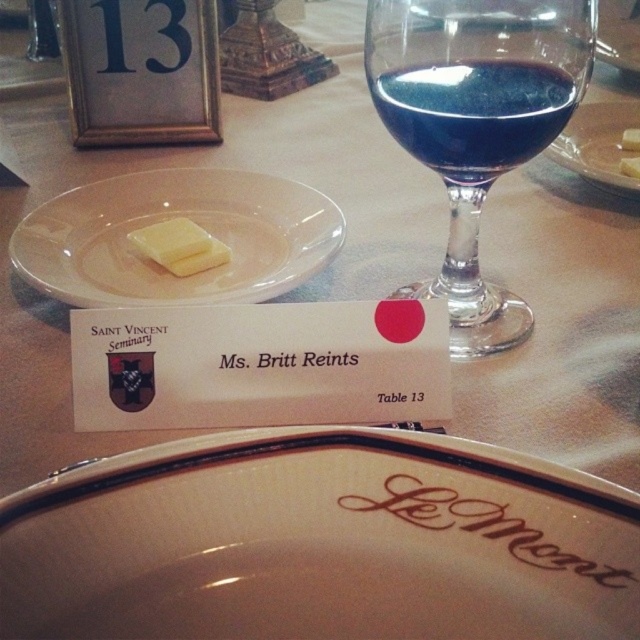
You are a guest at the event and want to place your napkin on the table. The host instructed you to put it to the left of the yellow butter at center. However, there is another yellow butter at upper left. Which butter should you use as a reference point for placing your napkin?

You should use the yellow butter at center as the reference point. The host specified placing the napkin to the left of the yellow butter at center, so even though there is another yellow butter at upper left, the instruction refers to the one at the center.

You are a server at the event and need to pour wine into the taller glass. Which one should you choose between the transparent glass wine glass at upper right and the blue glass wine at upper center?

The transparent glass wine glass at upper right is taller than the blue glass wine at upper center, so you should pour the wine into the transparent glass wine glass at upper right.